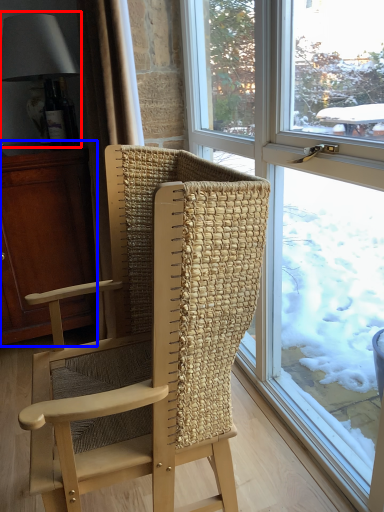
Question: Among these objects, which one is nearest to the camera, lamp (highlighted by a red box) or cabinetry (highlighted by a blue box)?

Choices:
 (A) lamp
 (B) cabinetry

Answer: (B)